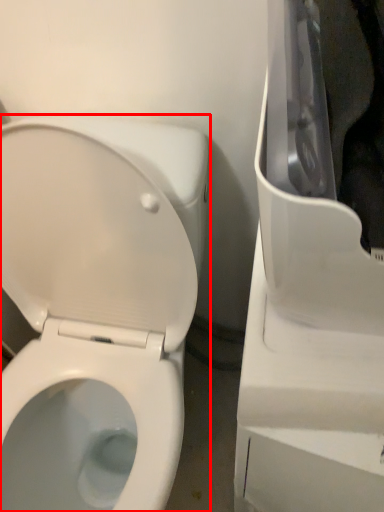
Question: From the image's perspective, where is toilet (annotated by the red box) located in relation to appliance in the image?

Choices:
 (A) above
 (B) below

Answer: (A)